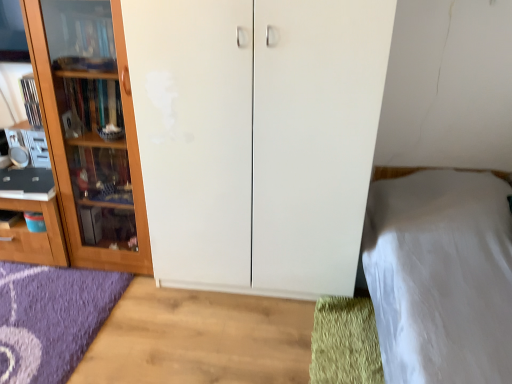
Question: Should I look upward or downward to see white matte cupboard at center, acting as the 1th cupboard starting from the right?

Choices:
 (A) down
 (B) up

Answer: (B)

Question: Is wooden cabinet at left, the 1th cupboard viewed from the left, to the left of white smooth bed at right from the viewer's perspective?

Choices:
 (A) no
 (B) yes

Answer: (B)

Question: Is wooden cabinet at left, the second cupboard when ordered from right to left, not within white smooth bed at right?

Choices:
 (A) yes
 (B) no

Answer: (A)

Question: Is wooden cabinet at left, the 1th cupboard viewed from the left, taller than white smooth bed at right?

Choices:
 (A) yes
 (B) no

Answer: (A)

Question: From the image's perspective, is wooden cabinet at left, the 1th cupboard viewed from the left, under white smooth bed at right?

Choices:
 (A) no
 (B) yes

Answer: (A)

Question: Is wooden cabinet at left, the 1th cupboard viewed from the left, positioned in front of white smooth bed at right?

Choices:
 (A) no
 (B) yes

Answer: (A)

Question: Is wooden cabinet at left, the 1th cupboard viewed from the left, beside white smooth bed at right?

Choices:
 (A) no
 (B) yes

Answer: (A)

Question: Would you say white smooth bed at right is outside green shaggy doormat at lower right?

Choices:
 (A) no
 (B) yes

Answer: (B)

Question: Is white smooth bed at right in contact with green shaggy doormat at lower right?

Choices:
 (A) no
 (B) yes

Answer: (A)

Question: Is the depth of white smooth bed at right less than that of green shaggy doormat at lower right?

Choices:
 (A) no
 (B) yes

Answer: (B)

Question: Is white smooth bed at right oriented towards green shaggy doormat at lower right?

Choices:
 (A) yes
 (B) no

Answer: (A)

Question: Is green shaggy doormat at lower right surrounded by white smooth bed at right?

Choices:
 (A) yes
 (B) no

Answer: (B)

Question: Is white smooth bed at right looking in the opposite direction of green shaggy doormat at lower right?

Choices:
 (A) no
 (B) yes

Answer: (A)

Question: Is white smooth bed at right wider than wooden cabinet at left, the second cupboard when ordered from right to left?

Choices:
 (A) yes
 (B) no

Answer: (A)